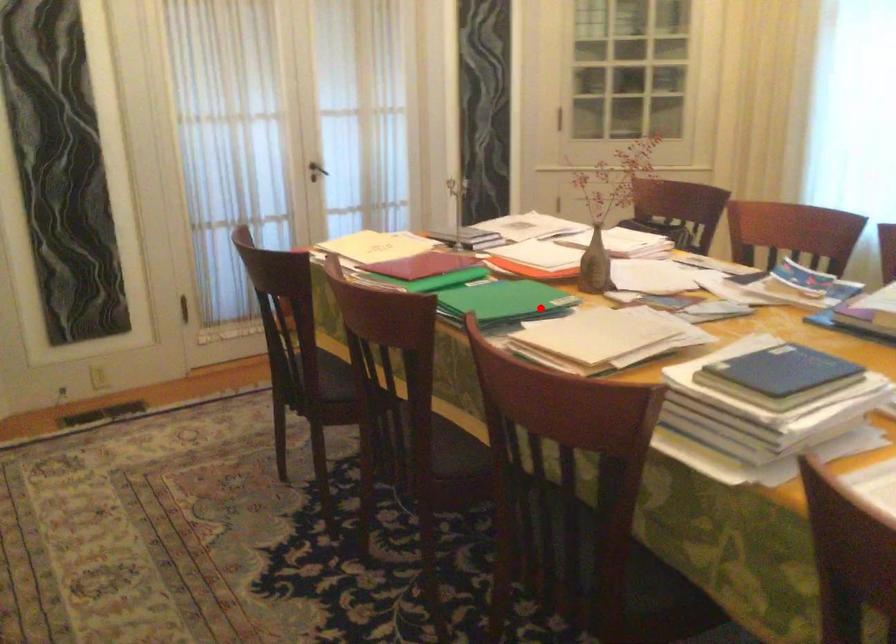
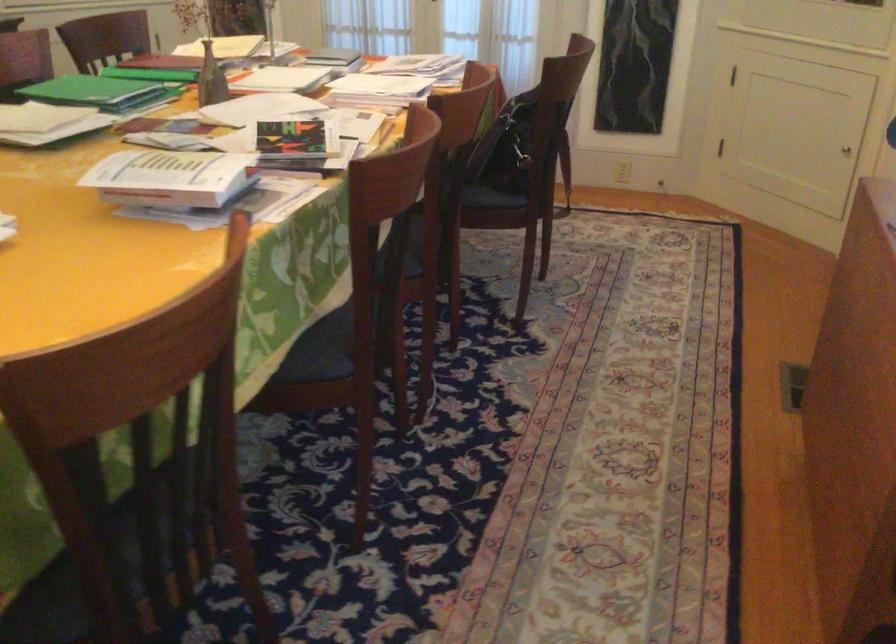
Find the pixel in the second image that matches the highlighted location in the first image.

(99, 91)